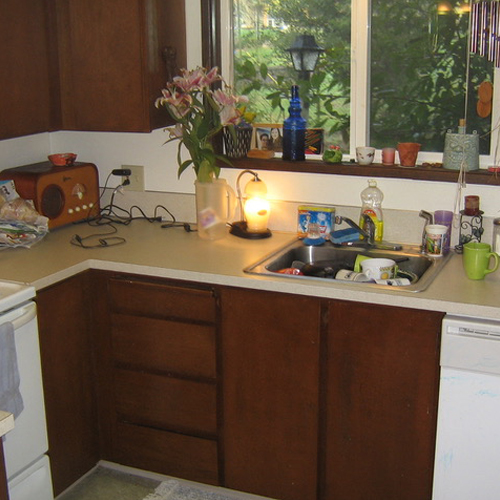
At what (x,y) coordinates should I click in order to perform the action: click on window panes. Please return your answer as a coordinate pair (x, y). Looking at the image, I should click on (322, 20), (413, 29).